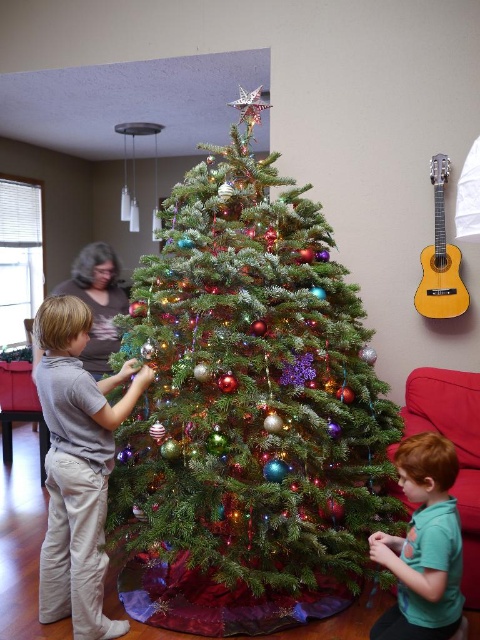
Question: Does green matte christmas tree at center appear on the left side of light gray cotton shirt at center?

Choices:
 (A) yes
 (B) no

Answer: (B)

Question: Among these points, which one is farthest from the camera?

Choices:
 (A) (440, 608)
 (B) (421, 276)
 (C) (165, 314)

Answer: (B)

Question: Is light gray cotton shirt at center to the right of green matte shirt at lower right from the viewer's perspective?

Choices:
 (A) no
 (B) yes

Answer: (A)

Question: Which of the following is the closest to the observer?

Choices:
 (A) light gray cotton shirt at center
 (B) green matte christmas tree at center
 (C) green matte shirt at lower right
 (D) yellow wood guitar at upper right

Answer: (C)

Question: Is green matte christmas tree at center thinner than yellow wood guitar at upper right?

Choices:
 (A) yes
 (B) no

Answer: (B)

Question: Which of the following is the closest to the observer?

Choices:
 (A) (435, 502)
 (B) (442, 240)
 (C) (337, 576)
 (D) (107, 465)

Answer: (A)